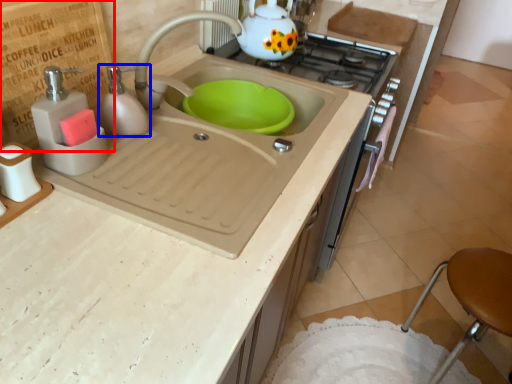
Question: Which object appears closest to the camera in this image, plywood (highlighted by a red box) or soap dispenser (highlighted by a blue box)?

Choices:
 (A) plywood
 (B) soap dispenser

Answer: (A)